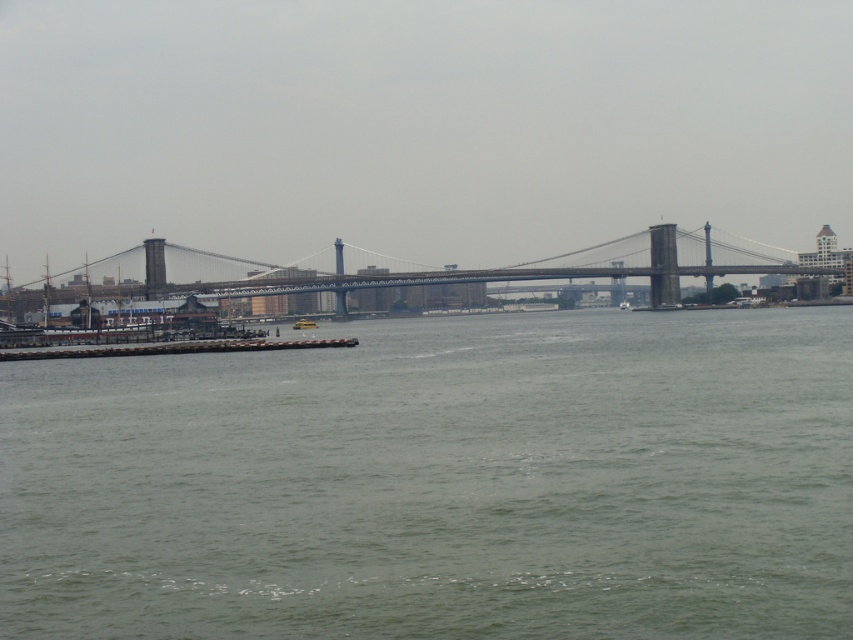
Question: Which is farther from the green water at lower center?

Choices:
 (A) metallic gray bridge at center
 (B) yellow plastic boat at center

Answer: (B)

Question: Is green water at lower center positioned in front of yellow plastic boat at center?

Choices:
 (A) yes
 (B) no

Answer: (A)

Question: Which of the following is the closest to the observer?

Choices:
 (A) yellow plastic boat at center
 (B) metallic gray bridge at center
 (C) green water at lower center

Answer: (C)

Question: Does green water at lower center appear on the right side of metallic gray bridge at center?

Choices:
 (A) no
 (B) yes

Answer: (B)

Question: Which point is closer to the camera taking this photo?

Choices:
 (A) (428, 368)
 (B) (292, 324)
 (C) (566, 264)

Answer: (A)

Question: Can you confirm if metallic gray bridge at center is wider than yellow plastic boat at center?

Choices:
 (A) yes
 (B) no

Answer: (A)